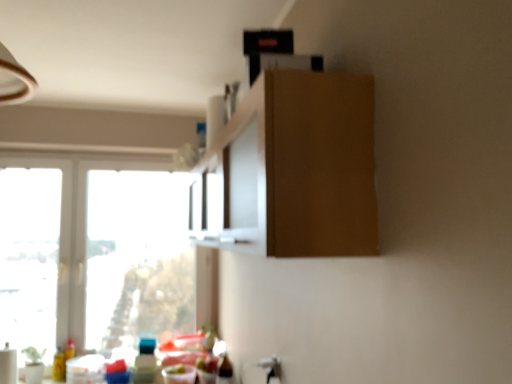
Question: Is matte wood cabinet at upper center to the left of translucent plastic bottle at lower left from the viewer's perspective?

Choices:
 (A) no
 (B) yes

Answer: (A)

Question: Is matte wood cabinet at upper center outside of translucent plastic bottle at lower left?

Choices:
 (A) yes
 (B) no

Answer: (A)

Question: Could you tell me if matte wood cabinet at upper center is facing translucent plastic bottle at lower left?

Choices:
 (A) no
 (B) yes

Answer: (A)

Question: Can you confirm if matte wood cabinet at upper center is shorter than translucent plastic bottle at lower left?

Choices:
 (A) no
 (B) yes

Answer: (A)

Question: Considering the relative sizes of matte wood cabinet at upper center and translucent plastic bottle at lower left in the image provided, is matte wood cabinet at upper center wider than translucent plastic bottle at lower left?

Choices:
 (A) no
 (B) yes

Answer: (B)

Question: Can you confirm if matte wood cabinet at upper center is taller than translucent plastic bottle at lower left?

Choices:
 (A) yes
 (B) no

Answer: (A)

Question: From a real-world perspective, is white glossy window at lower left physically below matte wood cabinet at upper center?

Choices:
 (A) yes
 (B) no

Answer: (A)

Question: Considering the relative positions of white glossy window at lower left and matte wood cabinet at upper center in the image provided, is white glossy window at lower left in front of matte wood cabinet at upper center?

Choices:
 (A) yes
 (B) no

Answer: (B)

Question: Is white glossy window at lower left in contact with matte wood cabinet at upper center?

Choices:
 (A) yes
 (B) no

Answer: (B)

Question: Would you say white glossy window at lower left is outside matte wood cabinet at upper center?

Choices:
 (A) yes
 (B) no

Answer: (A)

Question: From the image's perspective, would you say white glossy window at lower left is positioned over matte wood cabinet at upper center?

Choices:
 (A) no
 (B) yes

Answer: (A)

Question: Can you confirm if white glossy window at lower left is taller than matte wood cabinet at upper center?

Choices:
 (A) no
 (B) yes

Answer: (B)

Question: Does white glossy window at lower left have a greater height compared to translucent plastic bottle at lower left?

Choices:
 (A) yes
 (B) no

Answer: (A)